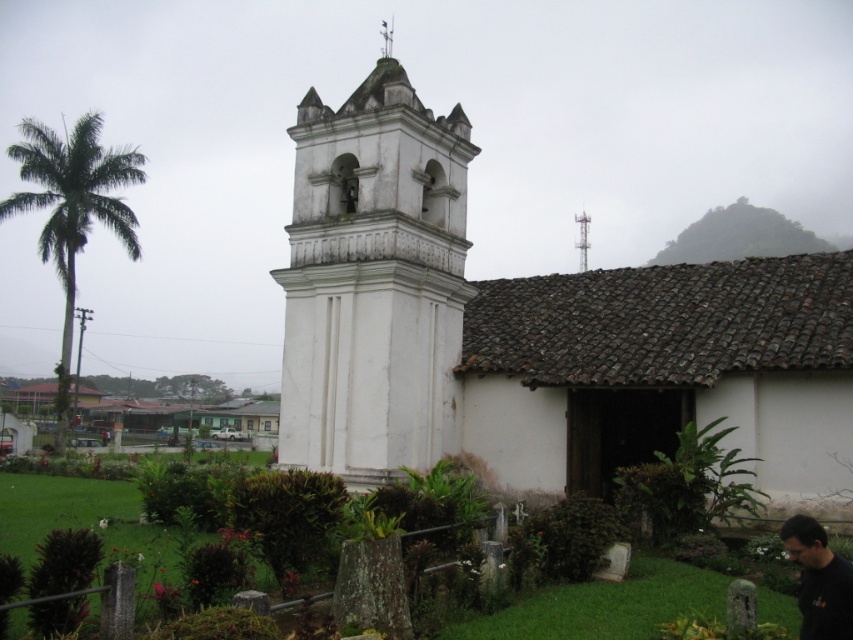
You are a tourist standing in front of the white stucco church at center and the black matte shirt at lower right. Which object is closer to you?

The white stucco church at center is closer to you because the black matte shirt at lower right is behind it.